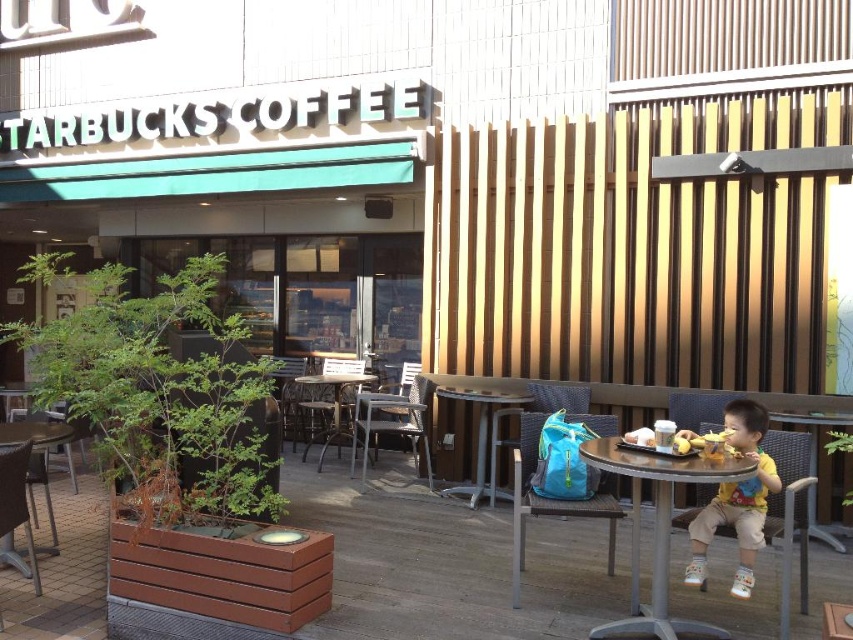
Between blue fabric backpack at center and metallic silver table at center, which one appears on the right side from the viewer's perspective?

From the viewer's perspective, blue fabric backpack at center appears more on the right side.

Which is below, blue fabric backpack at center or metallic silver table at center?

blue fabric backpack at center is lower down.

Who is more forward, (521,570) or (334,428)?

Point (521,570) is more forward.

The image size is (853, 640). I want to click on blue fabric backpack at center, so click(x=550, y=500).

Can you confirm if yellow cotton shirt at lower right is thinner than matte brown table at center?

Correct, yellow cotton shirt at lower right's width is less than matte brown table at center's.

In the scene shown: Does yellow cotton shirt at lower right appear on the left side of matte brown table at center?

Incorrect, yellow cotton shirt at lower right is not on the left side of matte brown table at center.

What are the coordinates of `yellow cotton shirt at lower right` in the screenshot? It's located at (735, 499).

Does matte brown table at center have a lesser width compared to wooden table at lower left?

No.

Is matte brown table at center above wooden table at lower left?

No.

Is point (492, 499) behind point (12, 426)?

That is True.

At what (x,y) coordinates should I click in order to perform the action: click on matte brown table at center. Please return your answer as a coordinate pair (x, y). Looking at the image, I should click on pyautogui.click(x=482, y=435).